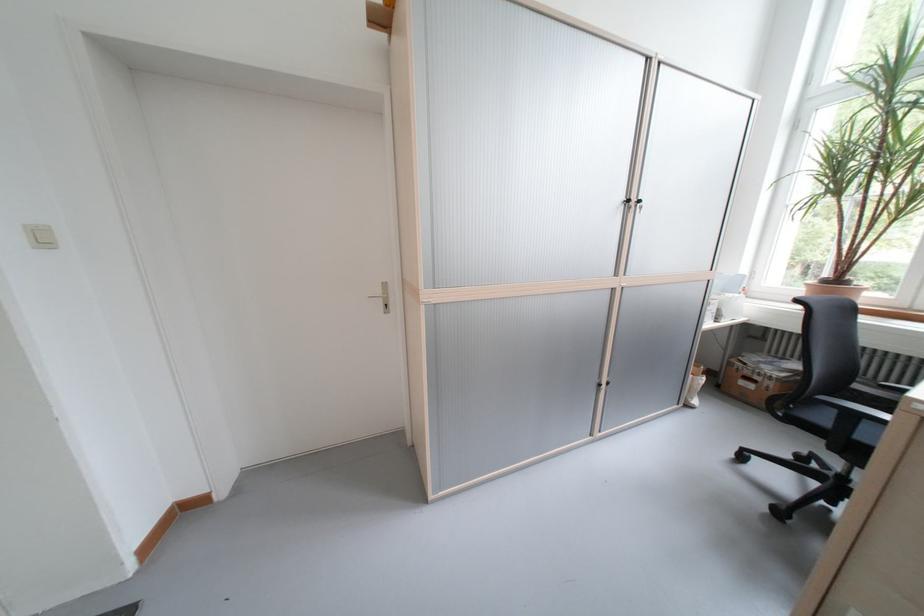
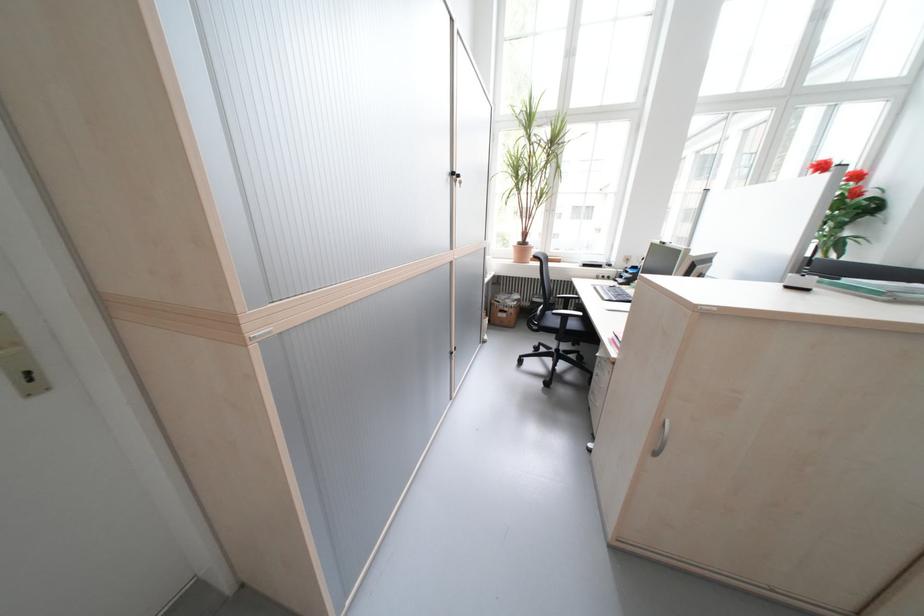
Where in the second image is the point corresponding to point 761,387 from the first image?

(515, 315)